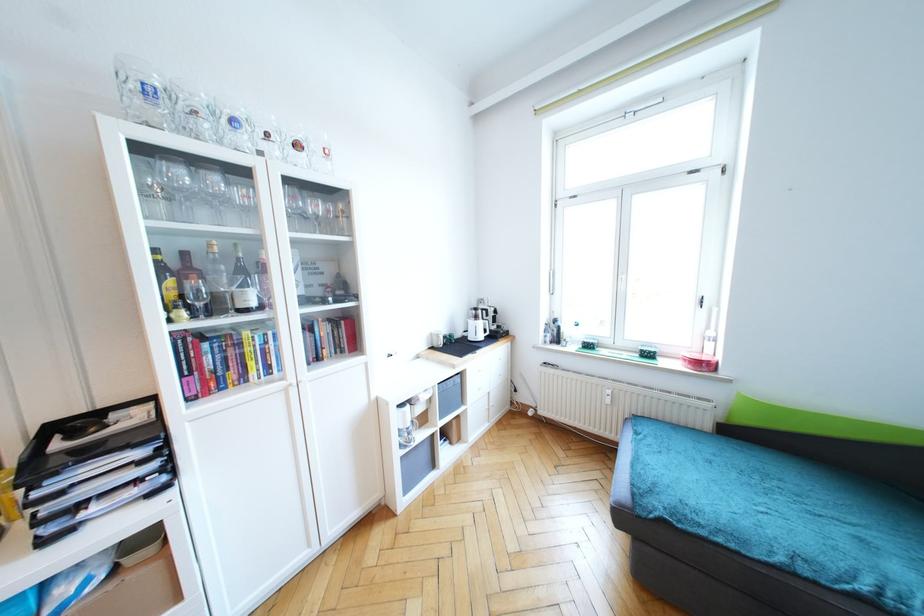
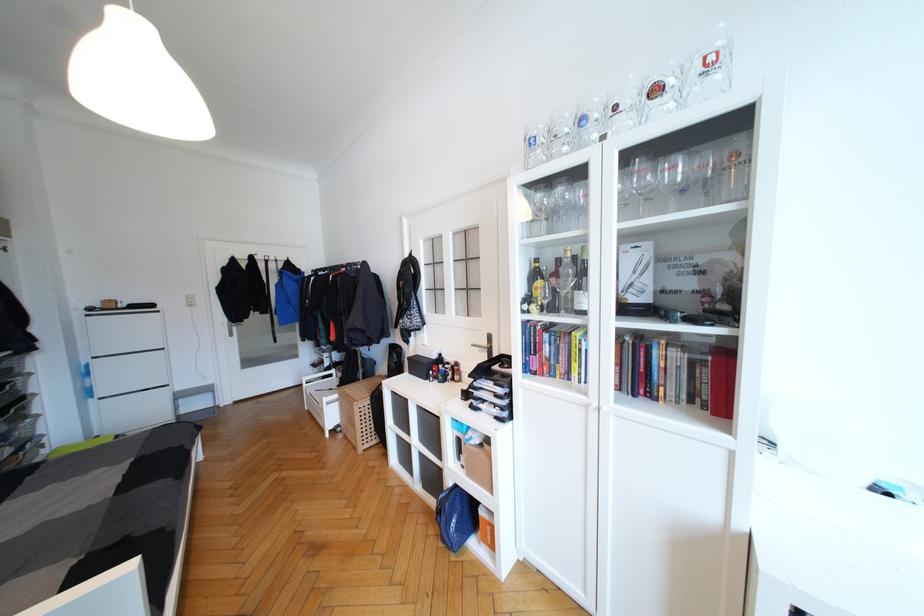
In the second image, find the point that corresponds to (152,90) in the first image.

(536, 142)